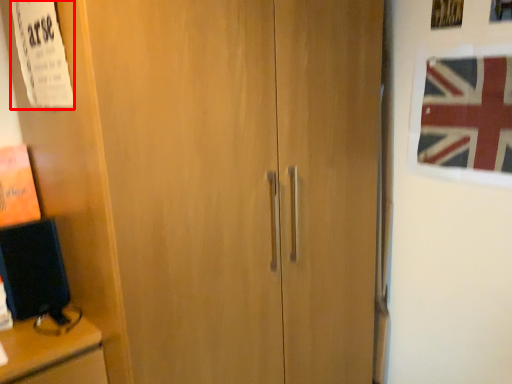
Question: From the image's perspective, where is poster (annotated by the red box) located in relation to flag in the image?

Choices:
 (A) above
 (B) below

Answer: (A)